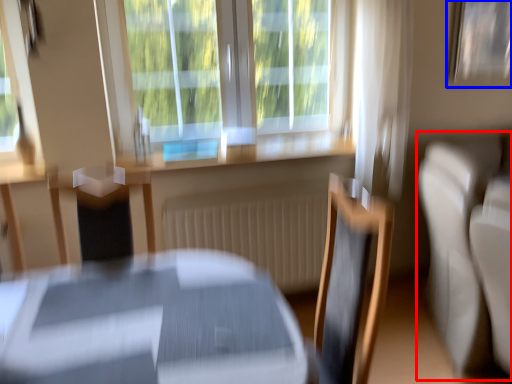
Question: Which object appears closest to the camera in this image, couch (highlighted by a red box) or picture frame (highlighted by a blue box)?

Choices:
 (A) couch
 (B) picture frame

Answer: (A)